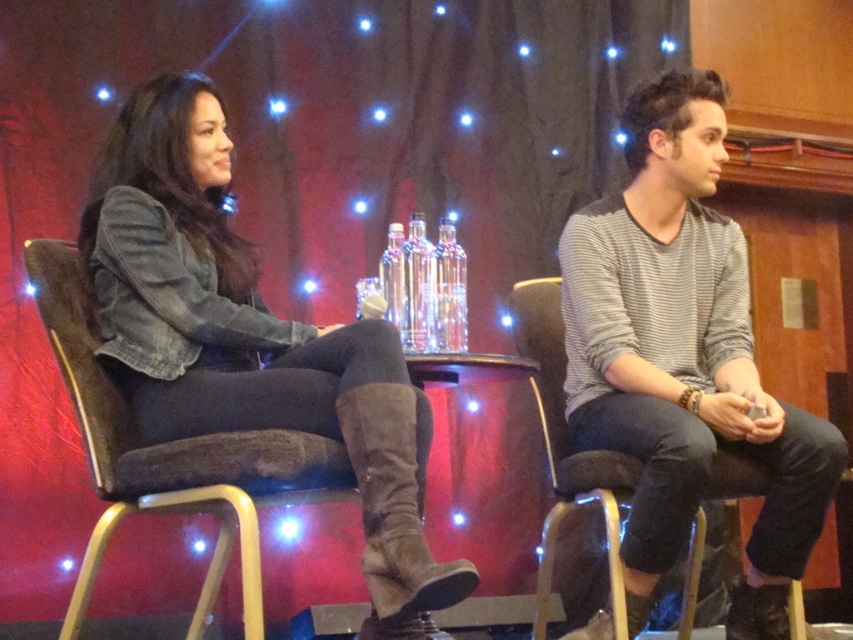
Question: Does striped knit sweater at center appear on the right side of brown fabric chair at left?

Choices:
 (A) no
 (B) yes

Answer: (B)

Question: Does striped knit sweater at center appear under suede boot at lower center?

Choices:
 (A) no
 (B) yes

Answer: (A)

Question: Which of these objects is positioned closest to the suede boot at lower center?

Choices:
 (A) brown fabric chair at left
 (B) denim jacket at left
 (C) striped knit sweater at center

Answer: (B)

Question: Which object appears farthest from the camera in this image?

Choices:
 (A) suede boot at lower center
 (B) brown fabric chair at left
 (C) denim jacket at left
 (D) striped knit sweater at center

Answer: (D)

Question: Which is farther from the denim jacket at left?

Choices:
 (A) brown fabric chair at left
 (B) striped knit sweater at center
 (C) suede boot at lower center

Answer: (B)

Question: Can you confirm if denim jacket at left is positioned below brown fabric chair at left?

Choices:
 (A) yes
 (B) no

Answer: (B)